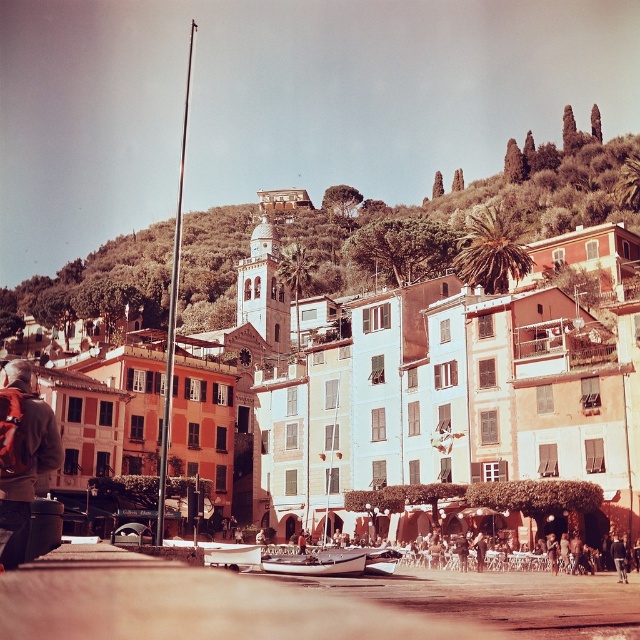
Which is in front, point (220, 280) or point (275, 554)?

Point (275, 554) is in front.

Who is more forward, (x=525, y=179) or (x=340, y=557)?

Positioned in front is point (x=340, y=557).

The width and height of the screenshot is (640, 640). I want to click on green leafy hillside at upper center, so click(x=404, y=225).

Who is higher up, matte stone buildings at center or red backpack at lower left?

matte stone buildings at center is higher up.

Does point (385, 385) come closer to viewer compared to point (32, 422)?

No.

Where is `matte stone buildings at center`? The image size is (640, 640). matte stone buildings at center is located at coordinates (467, 392).

Does red backpack at lower left have a larger size compared to metallic silver boat at lower center?

Indeed, red backpack at lower left has a larger size compared to metallic silver boat at lower center.

The height and width of the screenshot is (640, 640). Describe the element at coordinates (20, 456) in the screenshot. I see `red backpack at lower left` at that location.

In order to click on red backpack at lower left in this screenshot , I will do `click(20, 456)`.